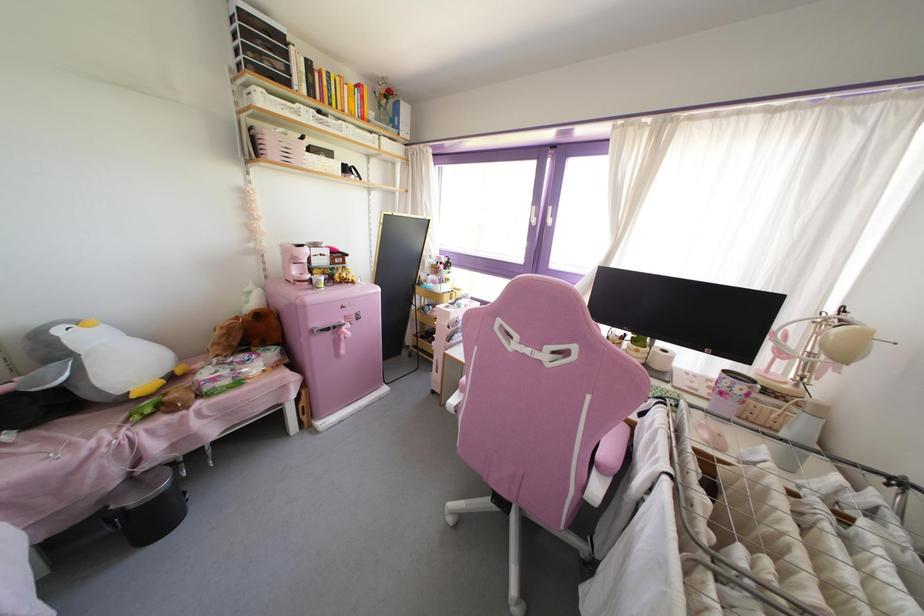
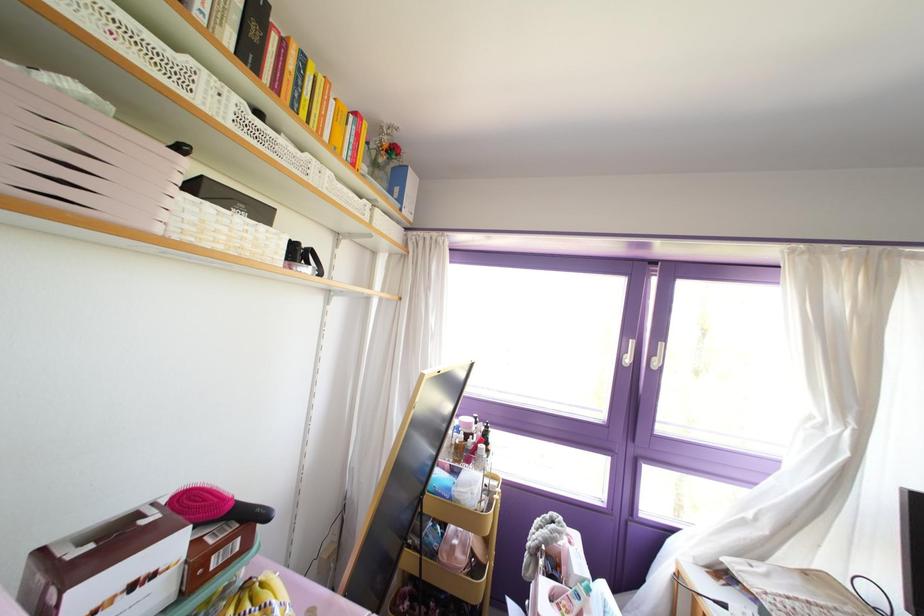
The images are taken continuously from a first-person perspective. In which direction are you moving?

The cameraman walked toward left, forward.